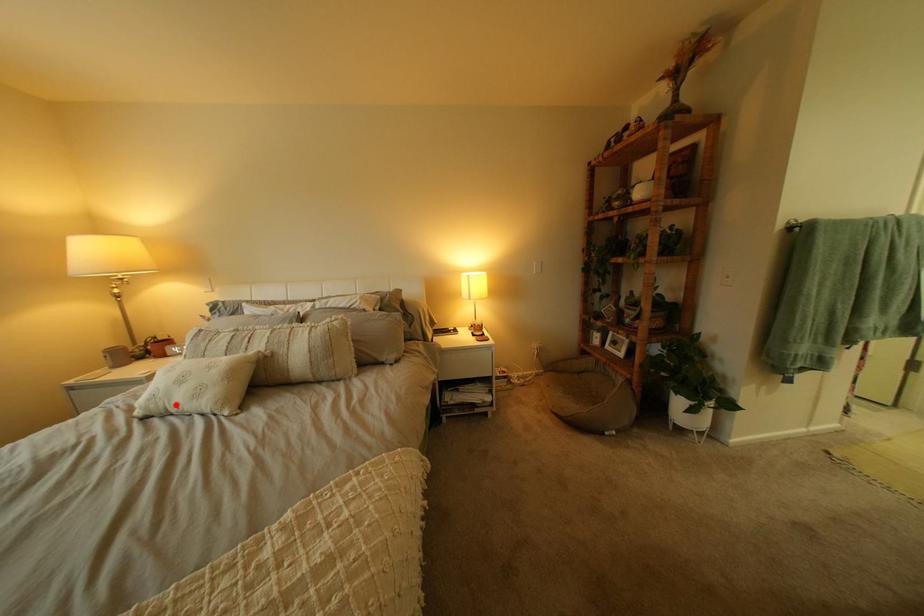
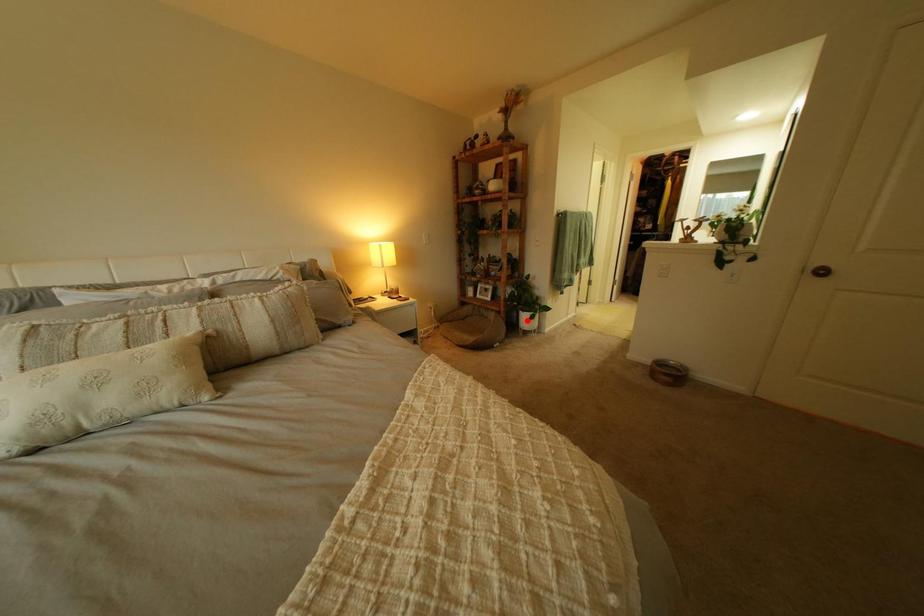
I am providing you with two images of the same scene from different viewpoints. A red point is marked on the first image and another point is marked on the second image. Are the points marked in image1 and image2 representing the same 3D position?

No